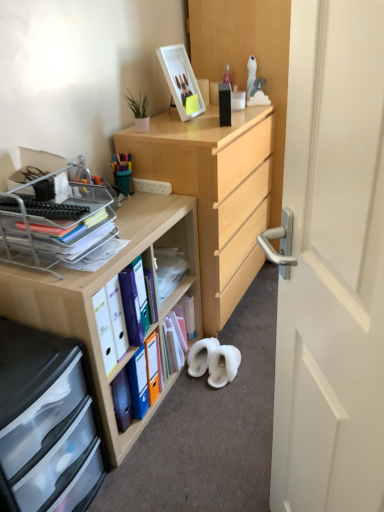
Locate an element on the screen. vacant area on top of transparent plastic drawers at lower left (from a real-world perspective) is located at coordinates (20, 368).